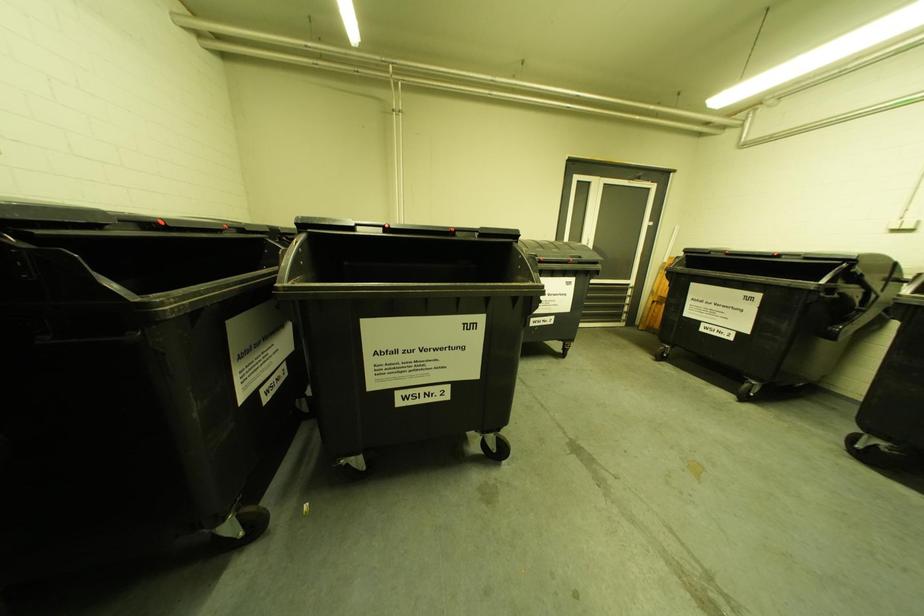
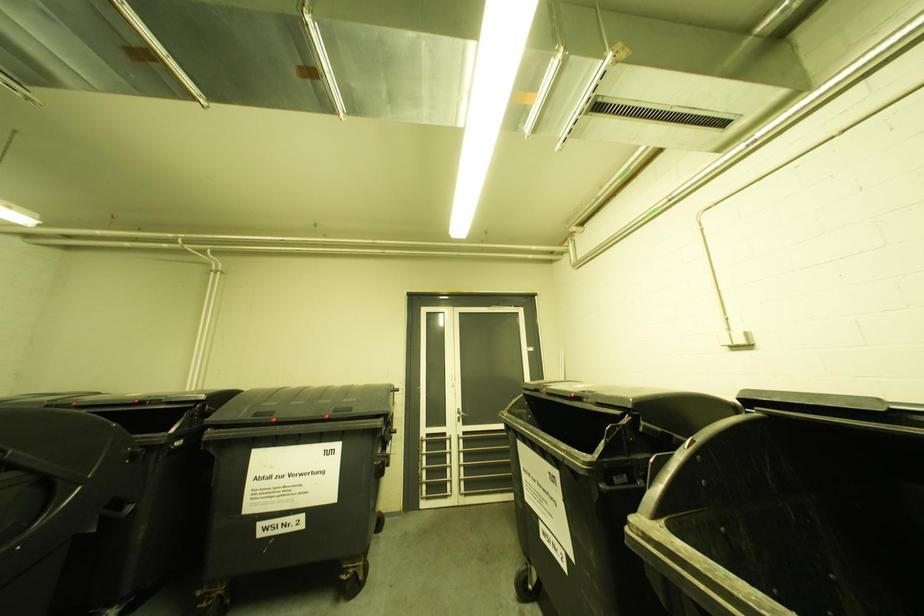
Question: The images are taken continuously from a first-person perspective. In which direction are you moving?

Choices:
 (A) Left
 (B) Right
 (C) Forward
 (D) Backward

Answer: (B)